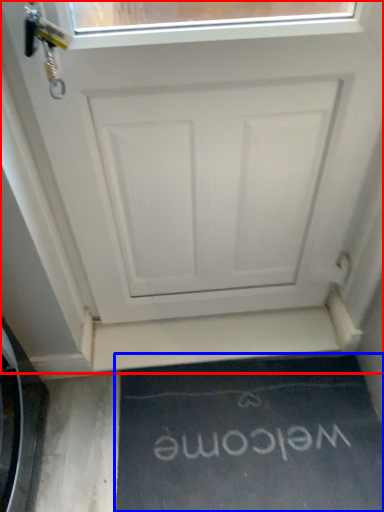
Question: Which point is further to the camera, door (highlighted by a red box) or doormat (highlighted by a blue box)?

Choices:
 (A) door
 (B) doormat

Answer: (B)